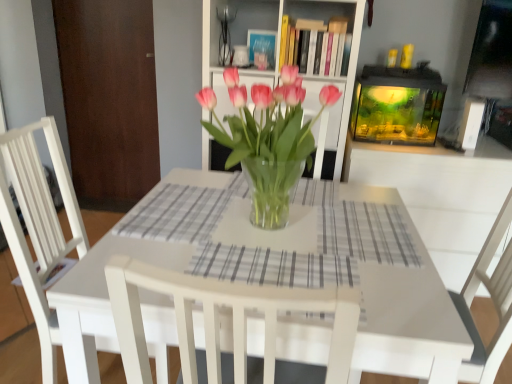
Image resolution: width=512 pixels, height=384 pixels. Find the location of `vacant area that is situated to the right of gray checkered placemat at center, placed as the first plaid when sorted from top to bottom`. vacant area that is situated to the right of gray checkered placemat at center, placed as the first plaid when sorted from top to bottom is located at coordinates (259, 224).